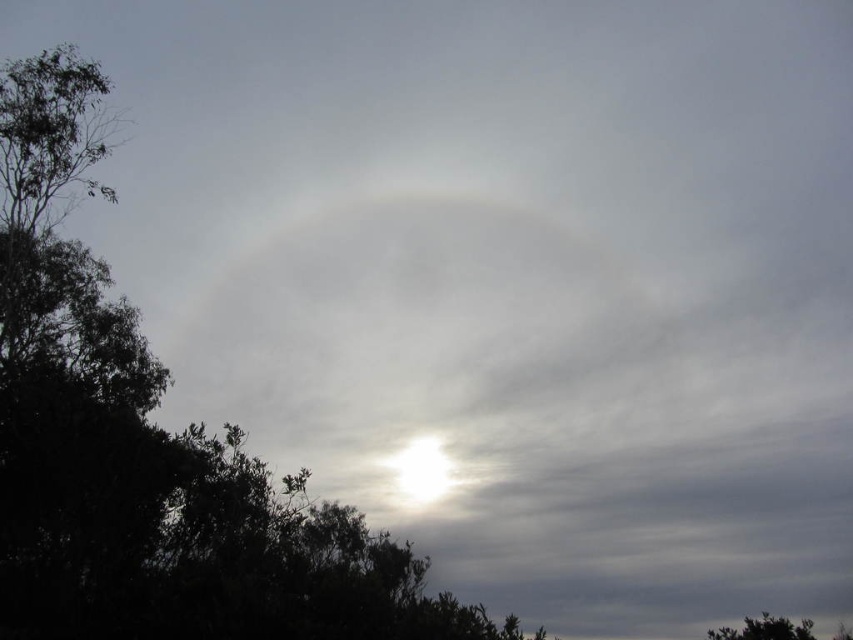
You are a drone operator planning to fly a drone between the green leafy tree at upper left and the green leafy tree at lower right. The drone has a maximum flight range of 12 meters. Based on the scene, will the drone be able to make the trip without needing to recharge?

The distance between the green leafy tree at upper left and the green leafy tree at lower right is 11.98 meters, which is just under the drone maximum flight range of 12 meters. Therefore, the drone should be able to make the trip without needing to recharge.

Based on the photo, you are an astronomer observing the sky scene described. You notice two points in the image, one at point coordinates point [149,579] and another at point [762,632]. Which point is closer to the observer?

Point [149,579] is in front of point [762,632], so it is closer to the observer.